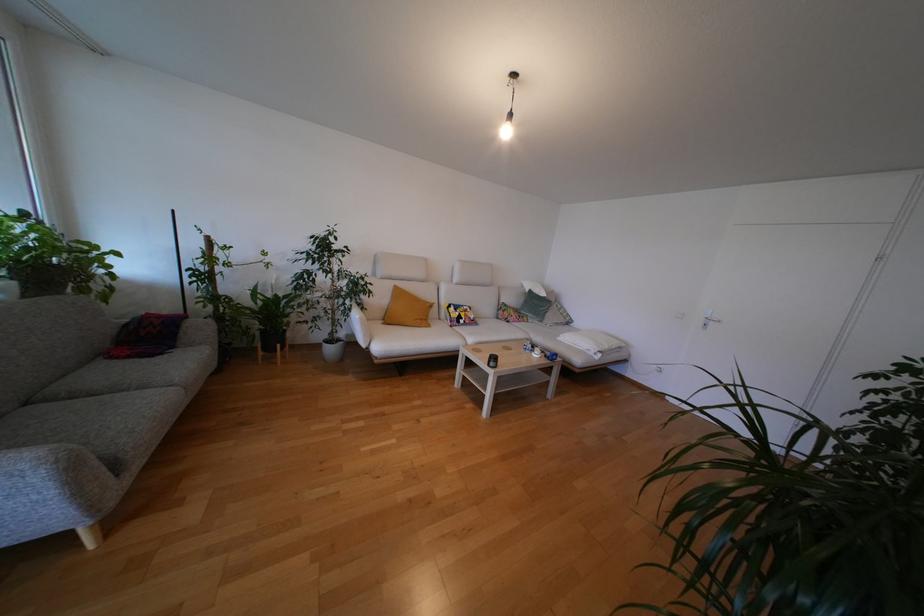
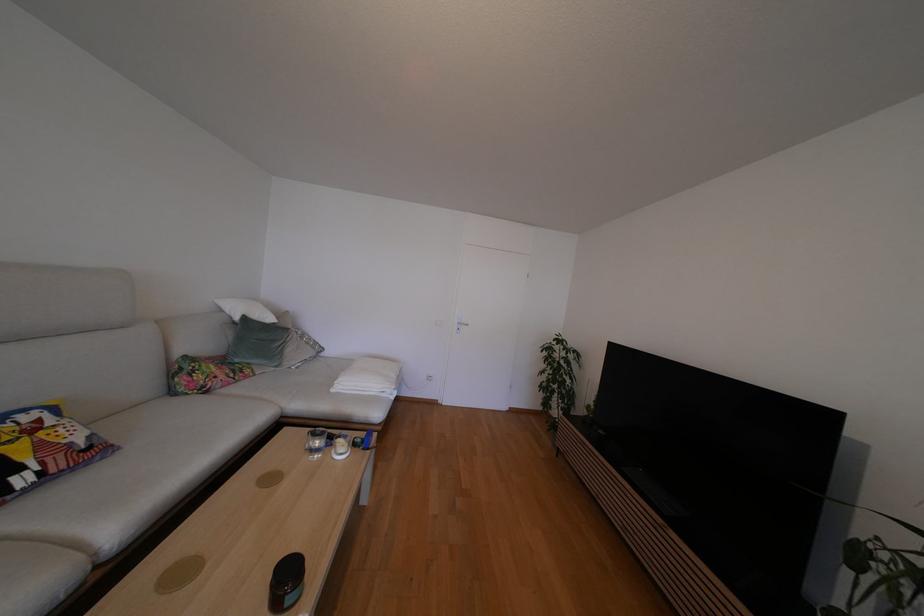
In the second image, find the point that corresponds to (x=528, y=290) in the first image.

(227, 314)